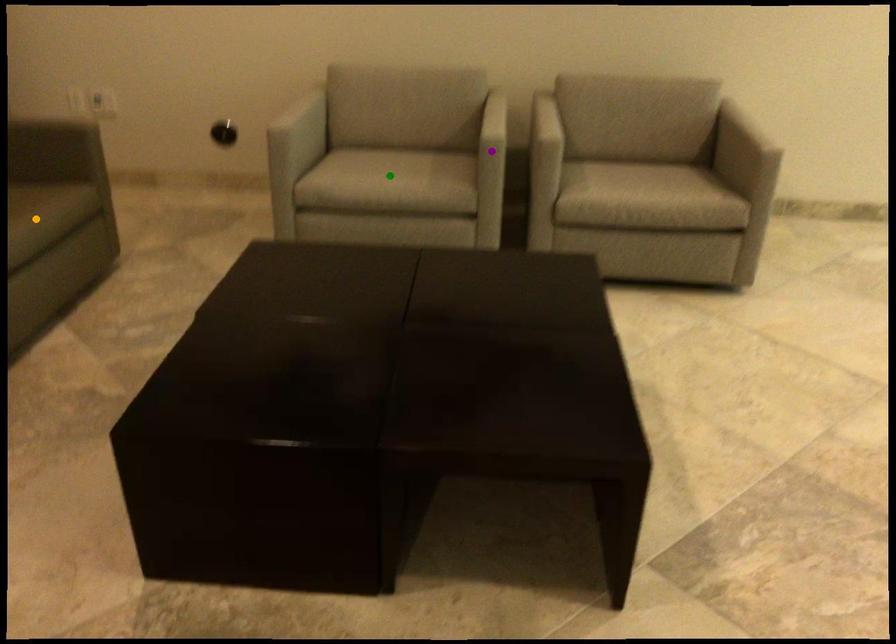
Order these from farthest to nearest:
orange point | purple point | green point

purple point
green point
orange point